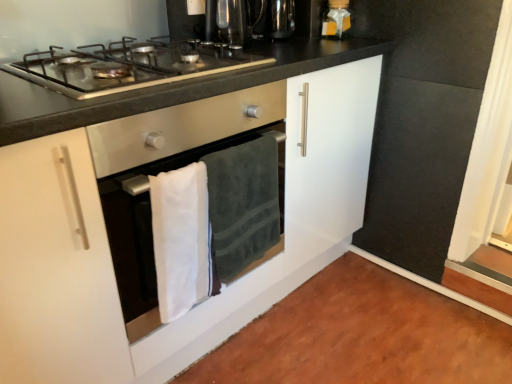
At what (x,y) coordinates should I click in order to perform the action: click on stainless steel gas stove at upper center. Please return your answer as a coordinate pair (x, y). The width and height of the screenshot is (512, 384). Looking at the image, I should click on (129, 66).

This screenshot has height=384, width=512. Describe the element at coordinates (181, 239) in the screenshot. I see `white cotton bath towel at center, which ranks as the 2th bath towel in right-to-left order` at that location.

You are a GUI agent. You are given a task and a screenshot of the screen. Output one action in this format:
    pyautogui.click(x=<x>, y=<y>)
    Task: Click on the metallic black coffee machine at upper center
    The width and height of the screenshot is (512, 384).
    Given the screenshot: What is the action you would take?
    pyautogui.click(x=231, y=21)

You are a GUI agent. You are given a task and a screenshot of the screen. Output one action in this format:
    pyautogui.click(x=<x>, y=<y>)
    Task: Click on the metallic stainless steel kettle at upper center
    
    Given the screenshot: What is the action you would take?
    pyautogui.click(x=272, y=18)

I want to click on matte gold gift box at upper right, so click(336, 19).

Looking at this image, which of these two, metallic stainless steel kettle at upper center or matte gold gift box at upper right, stands shorter?

With less height is metallic stainless steel kettle at upper center.

Which point is more forward, (x=250, y=15) or (x=328, y=30)?

Positioned in front is point (x=250, y=15).

Could matte gold gift box at upper right be considered to be inside metallic stainless steel kettle at upper center?

No, matte gold gift box at upper right is not surrounded by metallic stainless steel kettle at upper center.

Between metallic stainless steel kettle at upper center and matte gold gift box at upper right, which one has larger width?

metallic stainless steel kettle at upper center.

Considering the sizes of objects matte gold gift box at upper right and dark green plush towel at center, which appears as the second bath towel when viewed from the left, in the image provided, who is taller, matte gold gift box at upper right or dark green plush towel at center, which appears as the second bath towel when viewed from the left,?

dark green plush towel at center, which appears as the second bath towel when viewed from the left, is taller.

Identify the location of kitchen appliance that is above the dark green plush towel at center, the 1th bath towel in the right-to-left sequence (from the image's perspective). Image resolution: width=512 pixels, height=384 pixels. (336, 19).

Is matte gold gift box at upper right outside of dark green plush towel at center, which appears as the second bath towel when viewed from the left?

Yes, matte gold gift box at upper right is outside of dark green plush towel at center, which appears as the second bath towel when viewed from the left.

Can you confirm if matte gold gift box at upper right is thinner than dark green plush towel at center, the 1th bath towel in the right-to-left sequence?

Incorrect, the width of matte gold gift box at upper right is not less than that of dark green plush towel at center, the 1th bath towel in the right-to-left sequence.

Does metallic stainless steel kettle at upper center have a lesser width compared to white glossy cabinet at center?

Correct, the width of metallic stainless steel kettle at upper center is less than that of white glossy cabinet at center.

Is metallic stainless steel kettle at upper center positioned in front of white glossy cabinet at center?

Result: No.

Is dark green plush towel at center, which appears as the second bath towel when viewed from the left, positioned far away from metallic black coffee machine at upper center?

No, dark green plush towel at center, which appears as the second bath towel when viewed from the left, is in close proximity to metallic black coffee machine at upper center.

Locate an element on the screen. The height and width of the screenshot is (384, 512). bath towel on the right side of metallic black coffee machine at upper center is located at coordinates (243, 205).

Considering their positions, is dark green plush towel at center, which appears as the second bath towel when viewed from the left, located in front of or behind metallic black coffee machine at upper center?

Visually, dark green plush towel at center, which appears as the second bath towel when viewed from the left, is located in front of metallic black coffee machine at upper center.

From the picture: Can we say dark green plush towel at center, the 1th bath towel in the right-to-left sequence, lies outside metallic black coffee machine at upper center?

Yes, dark green plush towel at center, the 1th bath towel in the right-to-left sequence, is not within metallic black coffee machine at upper center.

Looking at their sizes, would you say stainless steel gas stove at upper center is wider or thinner than metallic black coffee machine at upper center?

Considering their sizes, stainless steel gas stove at upper center looks broader than metallic black coffee machine at upper center.

Which is correct: stainless steel gas stove at upper center is inside metallic black coffee machine at upper center, or outside of it?

stainless steel gas stove at upper center exists outside the volume of metallic black coffee machine at upper center.

Considering the sizes of objects stainless steel gas stove at upper center and metallic black coffee machine at upper center in the image provided, who is shorter, stainless steel gas stove at upper center or metallic black coffee machine at upper center?

Standing shorter between the two is stainless steel gas stove at upper center.

From the image's perspective, is stainless steel gas stove at upper center located above or below metallic black coffee machine at upper center?

Clearly, from the image's perspective, stainless steel gas stove at upper center is below metallic black coffee machine at upper center.

Does metallic black coffee machine at upper center have a smaller size compared to white cotton bath towel at center, arranged as the first bath towel when viewed from the left?

Indeed, metallic black coffee machine at upper center has a smaller size compared to white cotton bath towel at center, arranged as the first bath towel when viewed from the left.

Considering the positions of points (220, 38) and (175, 185), is point (220, 38) closer to camera compared to point (175, 185)?

That is False.

Is the surface of metallic black coffee machine at upper center in direct contact with white cotton bath towel at center, which ranks as the 2th bath towel in right-to-left order?

No, metallic black coffee machine at upper center is not touching white cotton bath towel at center, which ranks as the 2th bath towel in right-to-left order.

Considering the relative positions of metallic black coffee machine at upper center and white cotton bath towel at center, arranged as the first bath towel when viewed from the left, in the image provided, is metallic black coffee machine at upper center to the left of white cotton bath towel at center, arranged as the first bath towel when viewed from the left, from the viewer's perspective?

No.

Does white glossy cabinet at center contain dark green plush towel at center, the 1th bath towel in the right-to-left sequence?

No, dark green plush towel at center, the 1th bath towel in the right-to-left sequence, is not inside white glossy cabinet at center.

Is white glossy cabinet at center oriented away from dark green plush towel at center, which appears as the second bath towel when viewed from the left?

Yes, white glossy cabinet at center is positioned with its back facing dark green plush towel at center, which appears as the second bath towel when viewed from the left.

Which of these two, white glossy cabinet at center or dark green plush towel at center, which appears as the second bath towel when viewed from the left, is thinner?

Thinner between the two is dark green plush towel at center, which appears as the second bath towel when viewed from the left.

The height and width of the screenshot is (384, 512). Find the location of `appliance located above the matte gold gift box at upper right (from the image's perspective)`. appliance located above the matte gold gift box at upper right (from the image's perspective) is located at coordinates (272, 18).

Image resolution: width=512 pixels, height=384 pixels. In order to click on bath towel that is the 1st object to the left of the matte gold gift box at upper right, starting at the anchor in this screenshot , I will do coord(243,205).

Considering their positions, is dark green plush towel at center, which appears as the second bath towel when viewed from the left, positioned further to white cotton bath towel at center, arranged as the first bath towel when viewed from the left, than matte gold gift box at upper right?

The object further to white cotton bath towel at center, arranged as the first bath towel when viewed from the left, is matte gold gift box at upper right.

In the scene shown: Based on their spatial positions, is dark green plush towel at center, the 1th bath towel in the right-to-left sequence, or white cotton bath towel at center, arranged as the first bath towel when viewed from the left, closer to metallic black coffee machine at upper center?

dark green plush towel at center, the 1th bath towel in the right-to-left sequence.

Considering their positions, is metallic black coffee machine at upper center positioned closer to white glossy cabinet at center than stainless steel gas stove at upper center?

stainless steel gas stove at upper center is positioned closer to the anchor white glossy cabinet at center.

From the picture: Considering their positions, is metallic black coffee machine at upper center positioned further to matte gold gift box at upper right than white cotton bath towel at center, which ranks as the 2th bath towel in right-to-left order?

The object further to matte gold gift box at upper right is white cotton bath towel at center, which ranks as the 2th bath towel in right-to-left order.

Considering their positions, is metallic stainless steel kettle at upper center positioned closer to metallic black coffee machine at upper center than dark green plush towel at center, which appears as the second bath towel when viewed from the left?

The object closer to metallic black coffee machine at upper center is metallic stainless steel kettle at upper center.

Considering their positions, is metallic black coffee machine at upper center positioned further to stainless steel gas stove at upper center than white cotton bath towel at center, which ranks as the 2th bath towel in right-to-left order?

Based on the image, white cotton bath towel at center, which ranks as the 2th bath towel in right-to-left order, appears to be further to stainless steel gas stove at upper center.

Based on their spatial positions, is dark green plush towel at center, which appears as the second bath towel when viewed from the left, or metallic black coffee machine at upper center further from matte gold gift box at upper right?

Among the two, dark green plush towel at center, which appears as the second bath towel when viewed from the left, is located further to matte gold gift box at upper right.

Based on their spatial positions, is white cotton bath towel at center, which ranks as the 2th bath towel in right-to-left order, or dark green plush towel at center, which appears as the second bath towel when viewed from the left, closer to metallic black coffee machine at upper center?

The object closer to metallic black coffee machine at upper center is dark green plush towel at center, which appears as the second bath towel when viewed from the left.

Locate an element on the screen. The image size is (512, 384). coffee machine that lies between matte gold gift box at upper right and dark green plush towel at center, which appears as the second bath towel when viewed from the left, from top to bottom is located at coordinates (231, 21).

Identify the location of kitchen appliance between metallic stainless steel kettle at upper center and white cotton bath towel at center, arranged as the first bath towel when viewed from the left, vertically. 336,19.

Find the location of a particular element. This screenshot has height=384, width=512. gas stove between metallic stainless steel kettle at upper center and dark green plush towel at center, the 1th bath towel in the right-to-left sequence, in the up-down direction is located at coordinates (x=129, y=66).

Where is `gas stove between matte gold gift box at upper right and white cotton bath towel at center, arranged as the first bath towel when viewed from the left, in the vertical direction`? Image resolution: width=512 pixels, height=384 pixels. gas stove between matte gold gift box at upper right and white cotton bath towel at center, arranged as the first bath towel when viewed from the left, in the vertical direction is located at coordinates (129, 66).